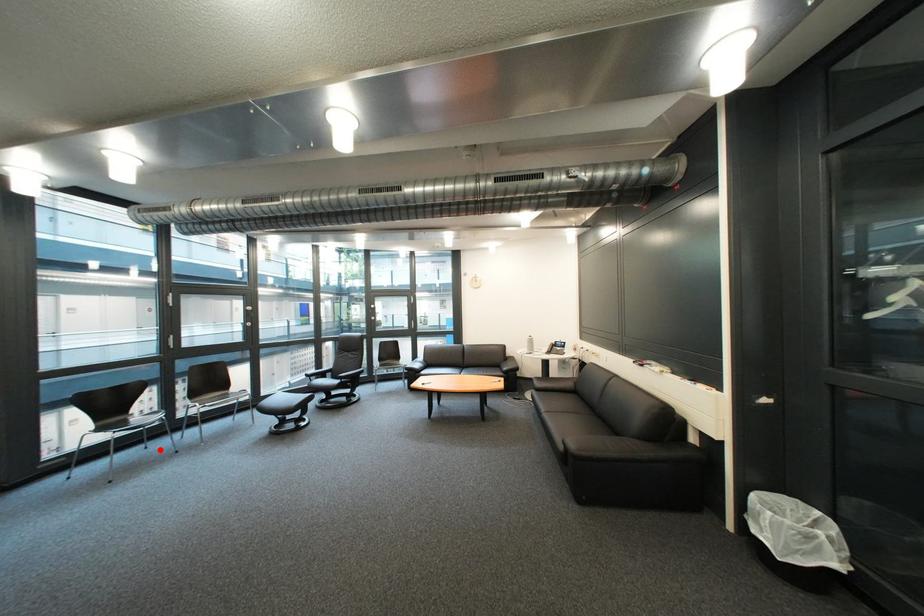
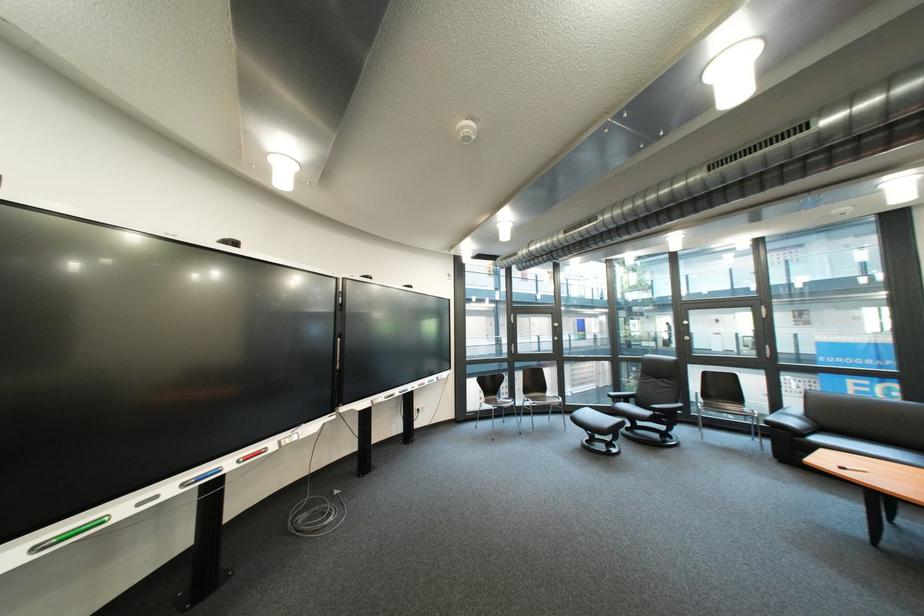
Question: I am providing you with two images of the same scene from different viewpoints. In image1, a red point is highlighted. Considering the same 3D point in image2, which of the following is correct?

Choices:
 (A) It is closer
 (B) It is farther

Answer: (B)